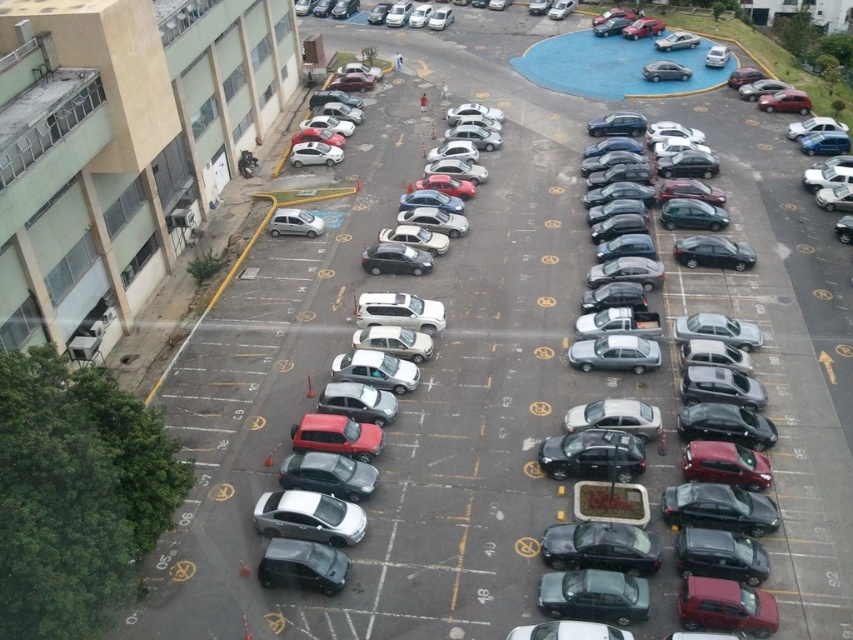
Is matte gray car at left further to camera compared to satin silver sedan at center-left?

That is False.

The image size is (853, 640). Find the location of `matte gray car at left`. matte gray car at left is located at coordinates (122, 145).

Can you confirm if metallic silver sedan at center is positioned above matte gray car at left?

Incorrect, metallic silver sedan at center is not positioned above matte gray car at left.

The image size is (853, 640). Describe the element at coordinates (527, 404) in the screenshot. I see `metallic silver sedan at center` at that location.

Locate an element on the screen. Image resolution: width=853 pixels, height=640 pixels. metallic silver sedan at center is located at coordinates (527, 404).

Can you confirm if silver metallic sedan at center is wider than matte gray car at left?

Indeed, silver metallic sedan at center has a greater width compared to matte gray car at left.

Is silver metallic sedan at center to the right of matte gray car at left from the viewer's perspective?

Yes, silver metallic sedan at center is to the right of matte gray car at left.

Which is behind, point (387, 500) or point (167, 193)?

The point (167, 193) is behind.

The image size is (853, 640). I want to click on silver metallic sedan at center, so click(407, 394).